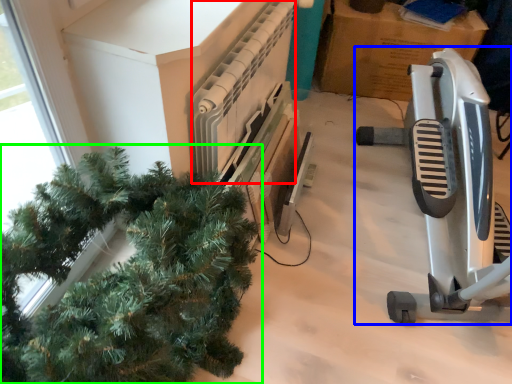
Question: Which object is positioned farthest from radiator (highlighted by a red box)? Select from job (highlighted by a blue box) and houseplant (highlighted by a green box).

Choices:
 (A) job
 (B) houseplant

Answer: (A)